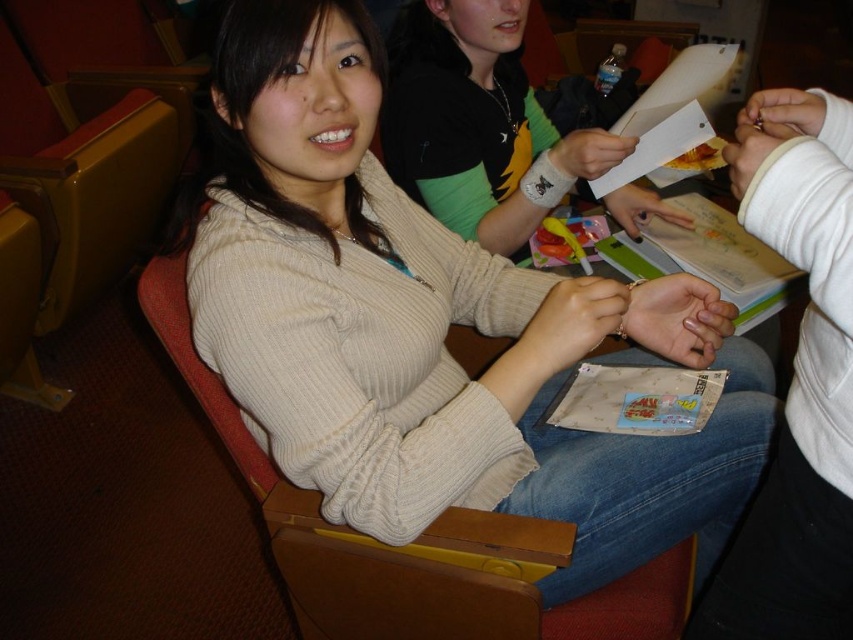
You are an observer looking at the scene. There are two sweaters in the image, the beige knit sweater at center and the white sweater at center. Which one is taller?

The beige knit sweater at center is taller than the white sweater at center.

Based on the photo, you are organizing a clothing donation drive and need to sort items by size. You have two sweaters in front of you, the beige knit sweater at center and the white sweater at center. Which one should you place in the large size bin?

The beige knit sweater at center is bigger than the white sweater at center, so it should be placed in the large size bin.